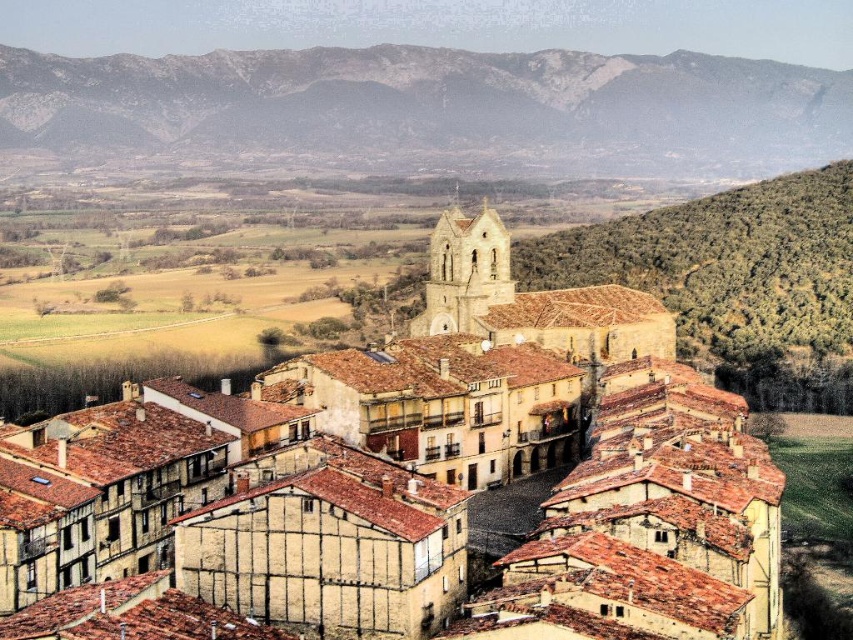
You are an architect analyzing the village layout. Based on the scene, which object is positioned to the right of the other between the brown clay roof tiles at center and the rugged stone mountain at upper left?

The brown clay roof tiles at center are positioned to the right of the rugged stone mountain at upper left.